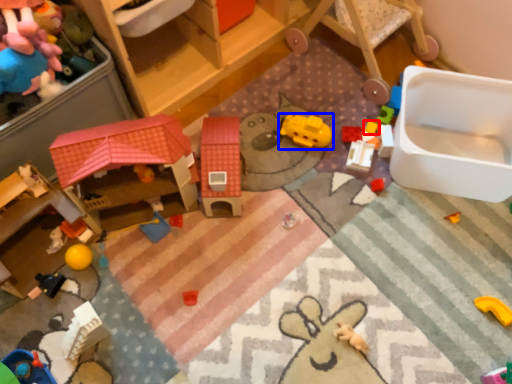
Question: Which object appears farthest to the camera in this image, toy (highlighted by a red box) or toy (highlighted by a blue box)?

Choices:
 (A) toy
 (B) toy

Answer: (A)